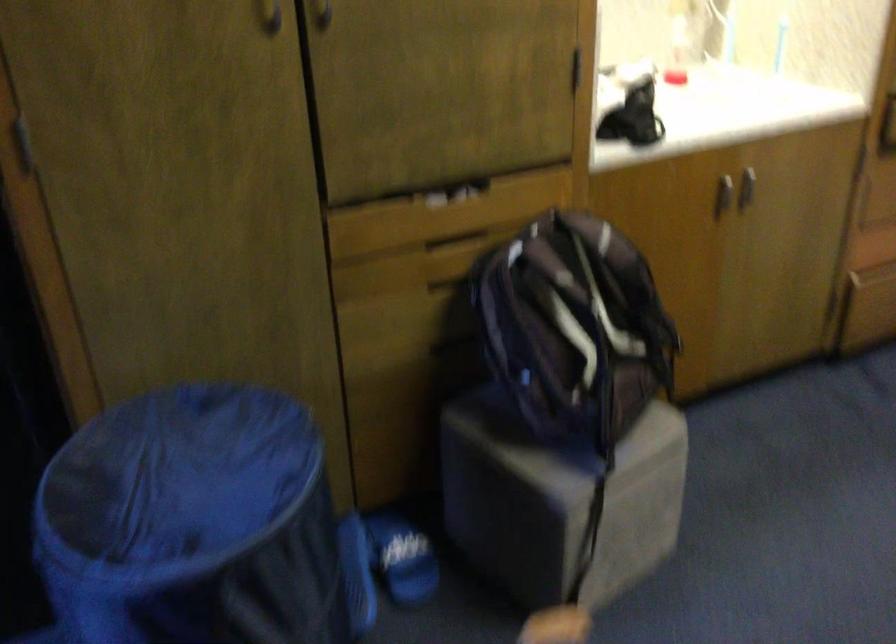
Where would you lift the backpack strap? Please return your answer as a coordinate pair (x, y).

(607, 310)